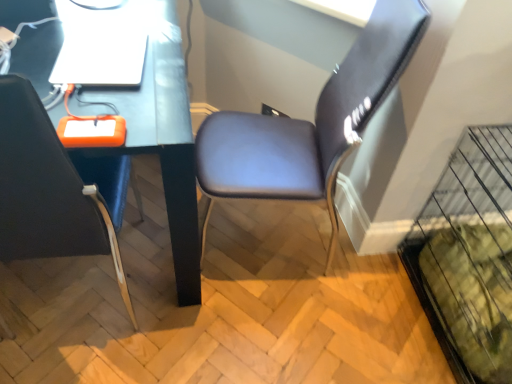
Where is `free space in front of white glossy laptop at upper left`? The width and height of the screenshot is (512, 384). free space in front of white glossy laptop at upper left is located at coordinates (95, 96).